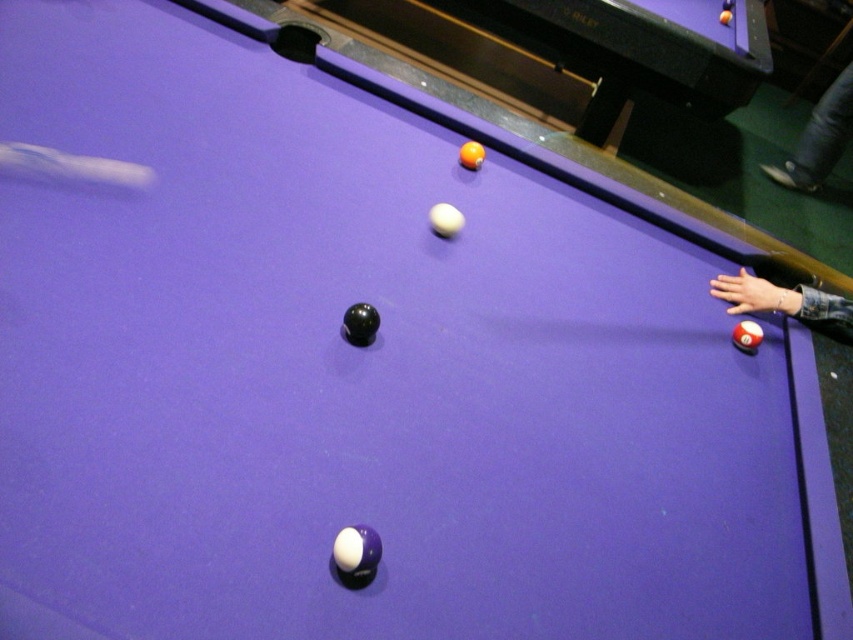
Question: Which point is closer to the camera?

Choices:
 (A) (793, 314)
 (B) (364, 26)
 (C) (836, 77)

Answer: (A)

Question: Does orange glossy ball at upper center appear on the left side of smooth leather hand at right?

Choices:
 (A) no
 (B) yes

Answer: (B)

Question: Which object is the closest to the denim pants at right?

Choices:
 (A) smooth leather hand at right
 (B) orange glossy ball at upper center

Answer: (B)

Question: Among these objects, which one is nearest to the camera?

Choices:
 (A) denim pants at right
 (B) orange glossy ball at upper center
 (C) smooth leather hand at right

Answer: (C)

Question: Can you confirm if orange glossy ball at upper center is positioned below smooth leather hand at right?

Choices:
 (A) yes
 (B) no

Answer: (B)

Question: Does orange glossy ball at upper center appear under smooth leather hand at right?

Choices:
 (A) no
 (B) yes

Answer: (A)